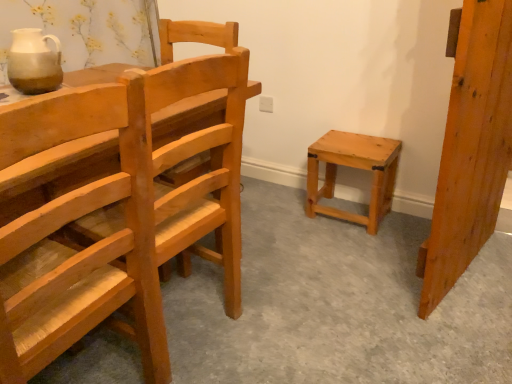
Where is `free space that is in between natural wood door at right and natural wood stool at center-right`? free space that is in between natural wood door at right and natural wood stool at center-right is located at coordinates (381, 246).